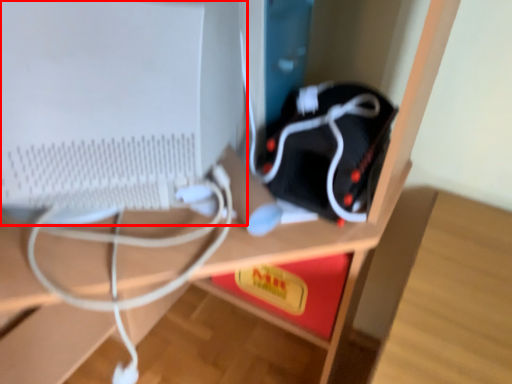
Question: From the image's perspective, considering the relative positions of computer monitor (annotated by the red box) and equipment in the image provided, where is computer monitor (annotated by the red box) located with respect to the staircase?

Choices:
 (A) below
 (B) above

Answer: (B)